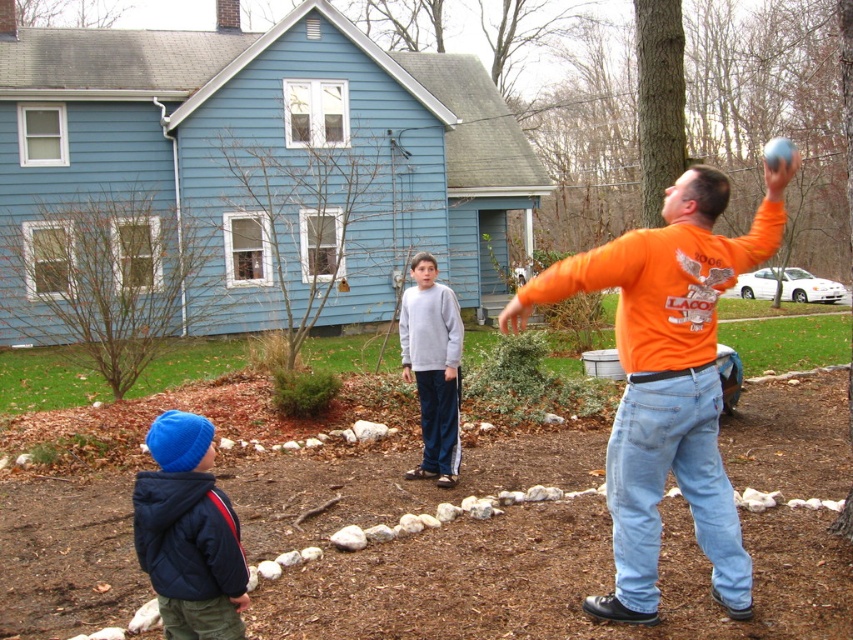
Who is lower down, orange cotton shirt at right or gray sweatshirt at center?

gray sweatshirt at center is lower down.

How far apart are orange cotton shirt at right and gray sweatshirt at center?

8.32 feet

Is point (709, 429) closer to viewer compared to point (416, 472)?

Yes, point (709, 429) is in front of point (416, 472).

Identify the location of orange cotton shirt at right. The image size is (853, 640). (668, 380).

Does orange cotton shirt at right have a smaller size compared to matte blue beanie at lower left?

Actually, orange cotton shirt at right might be larger than matte blue beanie at lower left.

Locate an element on the screen. The height and width of the screenshot is (640, 853). orange cotton shirt at right is located at coordinates tap(668, 380).

Can you confirm if matte blue beanie at lower left is positioned to the left of gray sweatshirt at center?

Correct, you'll find matte blue beanie at lower left to the left of gray sweatshirt at center.

What do you see at coordinates (189, 532) in the screenshot? This screenshot has width=853, height=640. I see `matte blue beanie at lower left` at bounding box center [189, 532].

Identify the location of matte blue beanie at lower left. (189, 532).